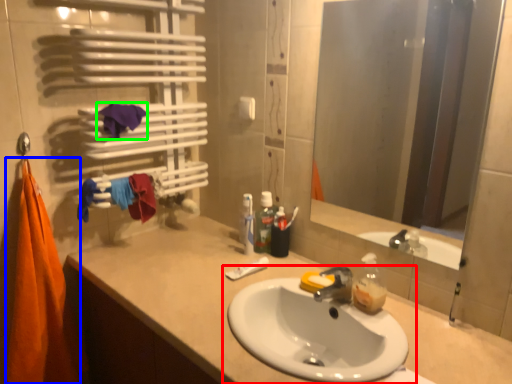
Question: Based on their relative distances, which object is farther from sink (highlighted by a red box)? Choose from beach towel (highlighted by a blue box) and beach towel (highlighted by a green box).

Choices:
 (A) beach towel
 (B) beach towel

Answer: (B)